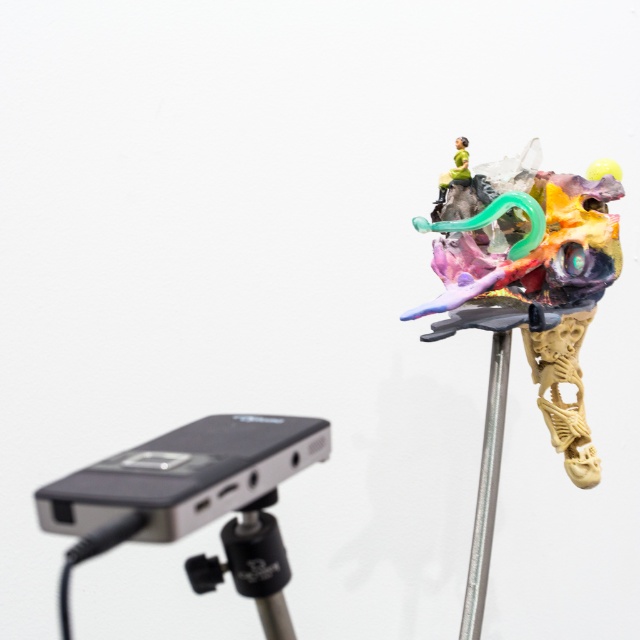
Can you confirm if multicolored plastic sculpture at upper right is positioned to the left of black plastic tripod at center?

In fact, multicolored plastic sculpture at upper right is to the right of black plastic tripod at center.

Based on the photo, does multicolored plastic sculpture at upper right appear on the right side of black plastic tripod at center?

Correct, you'll find multicolored plastic sculpture at upper right to the right of black plastic tripod at center.

You are a GUI agent. You are given a task and a screenshot of the screen. Output one action in this format:
    pyautogui.click(x=<x>, y=<y>)
    Task: Click on the multicolored plastic sculpture at upper right
    The image size is (640, 640).
    Given the screenshot: What is the action you would take?
    point(529,275)

Between point (582, 432) and point (474, 627), which one is positioned in front?

Point (474, 627) is more forward.

Where is `multicolored plastic sculpture at upper right`? multicolored plastic sculpture at upper right is located at coordinates (529, 275).

Is black plastic device at lower left taller than black plastic tripod at center?

Incorrect, black plastic device at lower left's height is not larger of black plastic tripod at center's.

Which is above, black plastic device at lower left or black plastic tripod at center?

black plastic device at lower left

Locate an element on the screen. Image resolution: width=640 pixels, height=640 pixels. black plastic device at lower left is located at coordinates (184, 476).